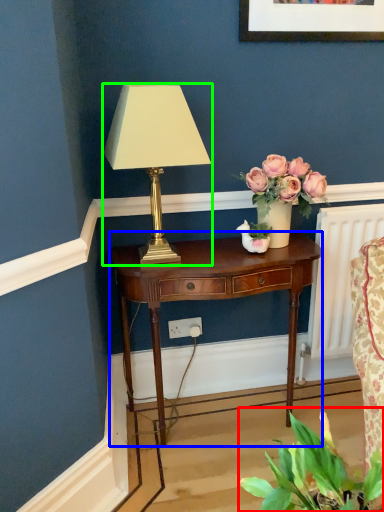
Question: Based on their relative distances, which object is farther from houseplant (highlighted by a red box)? Choose from nightstand (highlighted by a blue box) and lamp (highlighted by a green box).

Choices:
 (A) nightstand
 (B) lamp

Answer: (B)